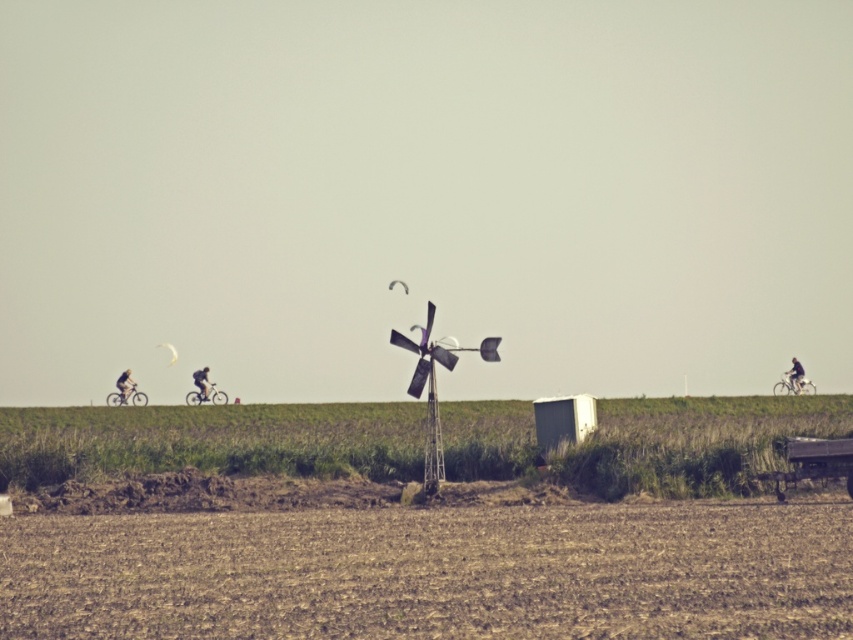
Question: Does matte black bicycle at left appear under metallic silver bicycle at center?

Choices:
 (A) yes
 (B) no

Answer: (A)

Question: Is silver metallic bicycle at right wider than matte black bicycle at left?

Choices:
 (A) yes
 (B) no

Answer: (B)

Question: Which of the following is the closest to the observer?

Choices:
 (A) coord(398,280)
 (B) coord(792,394)
 (C) coord(735,506)

Answer: (C)

Question: Does brown soil at center have a greater width compared to white fabric parachute at upper center?

Choices:
 (A) no
 (B) yes

Answer: (B)

Question: Estimate the real-world distances between objects in this image. Which object is farther from the matte black bicycle at left?

Choices:
 (A) metallic silver bicycle at center
 (B) transparent yellow parachute at upper center

Answer: (B)

Question: Which point is farther from the camera taking this photo?

Choices:
 (A) (440, 449)
 (B) (399, 285)

Answer: (B)